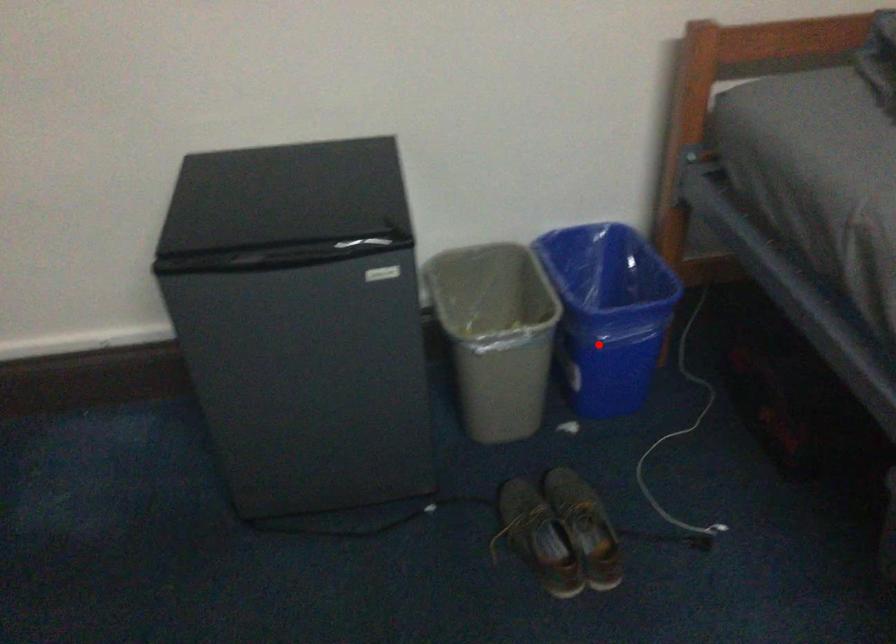
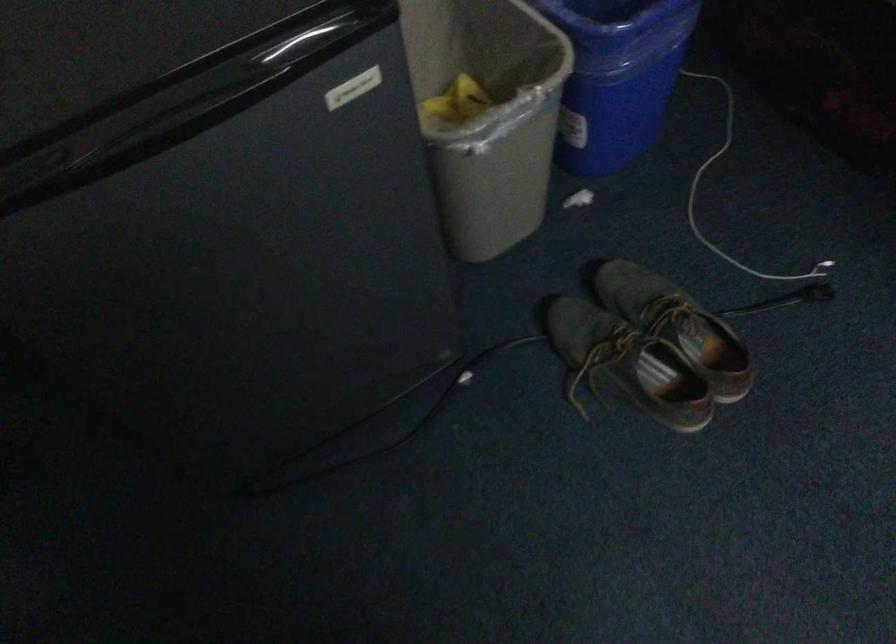
Question: I am providing you with two images of the same scene from different viewpoints. A red point is marked on the first image. At the location where the point appears in image 1, is it still visible in image 2?

Choices:
 (A) Yes
 (B) No

Answer: (A)